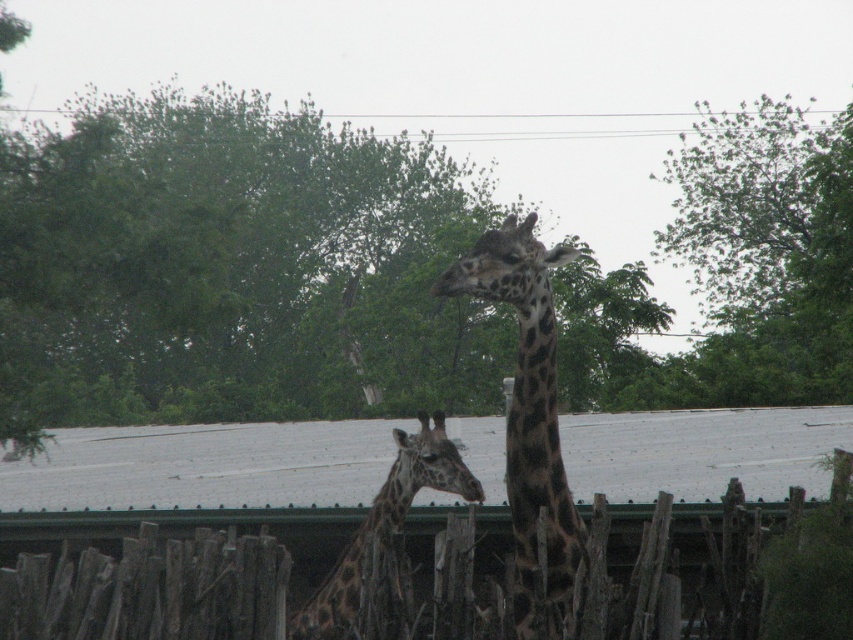
Question: Observing the image, what is the correct spatial positioning of wooden fence at center in reference to green leafy tree at upper right?

Choices:
 (A) above
 (B) below

Answer: (B)

Question: Which object appears farthest from the camera in this image?

Choices:
 (A) green leafy tree at upper right
 (B) wooden fence at center

Answer: (A)

Question: Can you confirm if green leafy tree at upper center is thinner than spotted fur giraffe at center?

Choices:
 (A) yes
 (B) no

Answer: (B)

Question: Considering the real-world distances, which object is closest to the spotted fur giraffe at center?

Choices:
 (A) spotted brown giraffe at center
 (B) green leafy tree at upper center
 (C) green leafy tree at upper right

Answer: (A)

Question: Which is farther from the wooden fence at center?

Choices:
 (A) green leafy tree at upper center
 (B) spotted fur giraffe at center
 (C) green leafy tree at upper right

Answer: (C)

Question: Is wooden fence at center smaller than green leafy tree at upper right?

Choices:
 (A) yes
 (B) no

Answer: (A)